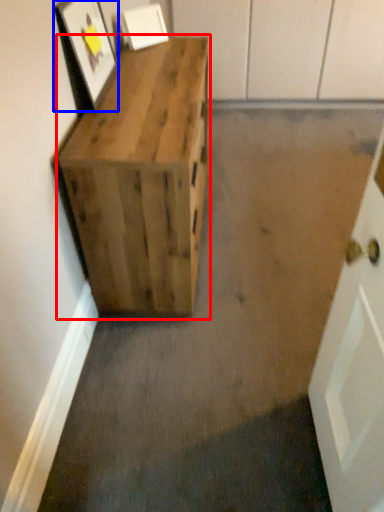
Question: Which point is further to the camera, furniture (highlighted by a red box) or picture frame (highlighted by a blue box)?

Choices:
 (A) furniture
 (B) picture frame

Answer: (B)